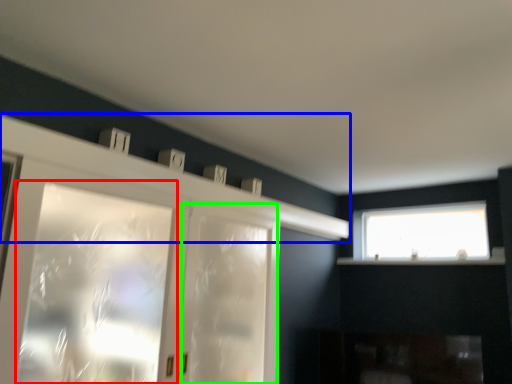
Question: Which object is the closest to the window (highlighted by a red box)? Choose among these: mantle (highlighted by a blue box) or screen door (highlighted by a green box).

Choices:
 (A) mantle
 (B) screen door

Answer: (B)